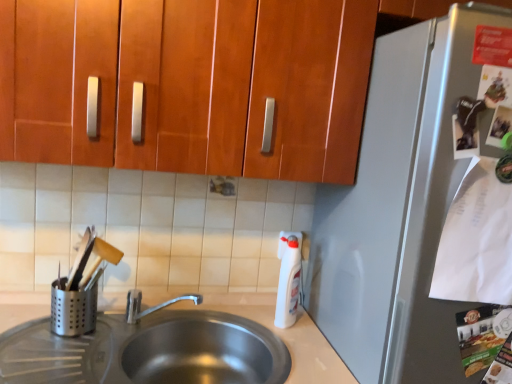
What is the approximate width of satin silver sink at lower left?

satin silver sink at lower left is 13.27 inches wide.

Find the location of a particular element. satin silver refrigerator at right is located at coordinates (399, 209).

Is wooden cabinet at upper center aimed at white plastic bottle at right?

No, wooden cabinet at upper center is not aimed at white plastic bottle at right.

From the picture: Is wooden cabinet at upper center directly adjacent to white plastic bottle at right?

No, wooden cabinet at upper center is not making contact with white plastic bottle at right.

From the image's perspective, is wooden cabinet at upper center beneath white plastic bottle at right?

No.

Is wooden cabinet at upper center taller than white plastic bottle at right?

Yes, wooden cabinet at upper center is taller than white plastic bottle at right.

Is satin silver refrigerator at right not within white plastic bottle at right?

Yes.

Does satin silver refrigerator at right come behind white plastic bottle at right?

No, satin silver refrigerator at right is closer to the camera.

Considering the positions of point (408, 192) and point (292, 289), is point (408, 192) closer or farther from the camera than point (292, 289)?

Point (408, 192) is positioned closer to the camera compared to point (292, 289).

Is white plastic bottle at right smaller than wooden cabinet at upper center?

Yes, white plastic bottle at right is smaller than wooden cabinet at upper center.

Considering the relative sizes of white plastic bottle at right and wooden cabinet at upper center in the image provided, is white plastic bottle at right taller than wooden cabinet at upper center?

Incorrect, the height of white plastic bottle at right is not larger of that of wooden cabinet at upper center.

Is white plastic bottle at right inside the boundaries of wooden cabinet at upper center, or outside?

white plastic bottle at right is spatially situated outside wooden cabinet at upper center.

Based on the photo, from the image's perspective, is white plastic bottle at right under wooden cabinet at upper center?

Yes.

Are satin silver sink at lower left and white plastic bottle at right located far from each other?

No, there isn't a large distance between satin silver sink at lower left and white plastic bottle at right.

From a real-world perspective, between satin silver sink at lower left and white plastic bottle at right, who is vertically lower?

satin silver sink at lower left, from a real-world perspective.

From the image's perspective, who appears lower, satin silver sink at lower left or white plastic bottle at right?

From the image's view, satin silver sink at lower left is below.

In terms of width, does satin silver sink at lower left look wider or thinner when compared to white plastic bottle at right?

In the image, satin silver sink at lower left appears to be wider than white plastic bottle at right.

Is white plastic bottle at right inside or outside of satin silver refrigerator at right?

white plastic bottle at right exists outside the volume of satin silver refrigerator at right.

Is white plastic bottle at right with satin silver refrigerator at right?

No, white plastic bottle at right is not making contact with satin silver refrigerator at right.

Is white plastic bottle at right bigger than satin silver refrigerator at right?

No, white plastic bottle at right is not bigger than satin silver refrigerator at right.

Is point (282, 236) in front of point (393, 45)?

No, it is behind (393, 45).

Is satin silver sink at lower left with satin silver refrigerator at right?

No, satin silver sink at lower left is not touching satin silver refrigerator at right.

From the image's perspective, between satin silver sink at lower left and satin silver refrigerator at right, which one is located above?

satin silver refrigerator at right, from the image's perspective.

Considering the sizes of objects satin silver sink at lower left and satin silver refrigerator at right in the image provided, who is smaller, satin silver sink at lower left or satin silver refrigerator at right?

satin silver sink at lower left is smaller.

Locate an element on the screen. countertop located behind the satin silver refrigerator at right is located at coordinates (285, 336).

Are satin silver sink at lower left and wooden cabinet at upper center located far from each other?

Actually, satin silver sink at lower left and wooden cabinet at upper center are a little close together.

Does point (8, 297) appear closer or farther from the camera than point (257, 9)?

Point (8, 297) is positioned farther from the camera compared to point (257, 9).

Which of these two, satin silver sink at lower left or wooden cabinet at upper center, is thinner?

With smaller width is satin silver sink at lower left.

Is satin silver sink at lower left looking in the opposite direction of wooden cabinet at upper center?

satin silver sink at lower left is not turned away from wooden cabinet at upper center.

The image size is (512, 384). What are the coordinates of `cabinetry on the left of white plastic bottle at right` in the screenshot? It's located at (189, 83).

The width and height of the screenshot is (512, 384). Identify the location of bottle located behind the satin silver refrigerator at right. (288, 280).

Looking at the image, which one is located closer to satin silver refrigerator at right, silver metallic utensil holder at left or white plastic bottle at right?

white plastic bottle at right is closer to satin silver refrigerator at right.

When comparing their distances from satin silver sink at lower left, does white plastic bottle at right or silver metallic utensil holder at left seem further?

silver metallic utensil holder at left is further to satin silver sink at lower left.

Estimate the real-world distances between objects in this image. Which object is further from wooden cabinet at upper center, silver metallic utensil holder at left or satin silver refrigerator at right?

silver metallic utensil holder at left is further to wooden cabinet at upper center.

From the image, which object appears to be nearer to white plastic bottle at right, wooden cabinet at upper center or silver metallic utensil holder at left?

The object closer to white plastic bottle at right is wooden cabinet at upper center.

Considering their positions, is satin silver sink at lower left positioned further to white plastic bottle at right than wooden cabinet at upper center?

wooden cabinet at upper center is further to white plastic bottle at right.

Estimate the real-world distances between objects in this image. Which object is closer to white plastic bottle at right, wooden cabinet at upper center or satin silver sink at lower left?

satin silver sink at lower left.

Estimate the real-world distances between objects in this image. Which object is further from wooden cabinet at upper center, satin silver sink at lower left or satin silver refrigerator at right?

satin silver sink at lower left is further to wooden cabinet at upper center.

Considering their positions, is white plastic bottle at right positioned further to satin silver refrigerator at right than wooden cabinet at upper center?

white plastic bottle at right is positioned further to the anchor satin silver refrigerator at right.

Image resolution: width=512 pixels, height=384 pixels. Find the location of `bottle between wooden cabinet at upper center and silver metallic utensil holder at left from top to bottom`. bottle between wooden cabinet at upper center and silver metallic utensil holder at left from top to bottom is located at coordinates (288, 280).

The image size is (512, 384). In order to click on bottle between silver metallic utensil holder at left and satin silver refrigerator at right in this screenshot , I will do `click(288, 280)`.

The image size is (512, 384). Find the location of `countertop between silver metallic utensil holder at left and white plastic bottle at right`. countertop between silver metallic utensil holder at left and white plastic bottle at right is located at coordinates (285, 336).

Image resolution: width=512 pixels, height=384 pixels. Find the location of `refrigerator between wooden cabinet at upper center and white plastic bottle at right from top to bottom`. refrigerator between wooden cabinet at upper center and white plastic bottle at right from top to bottom is located at coordinates (399, 209).